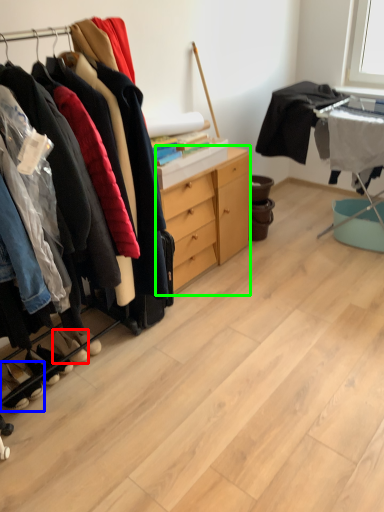
Question: Which object is the closest to the footwear (highlighted by a red box)? Choose among these: footwear (highlighted by a blue box) or cabinetry (highlighted by a green box).

Choices:
 (A) footwear
 (B) cabinetry

Answer: (A)